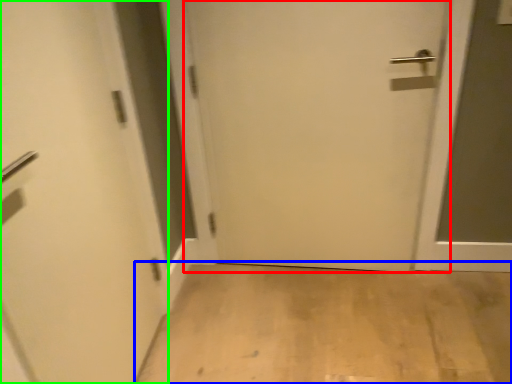
Question: Which is farther away from door (highlighted by a red box)? corridor (highlighted by a blue box) or door (highlighted by a green box)?

Choices:
 (A) corridor
 (B) door

Answer: (B)